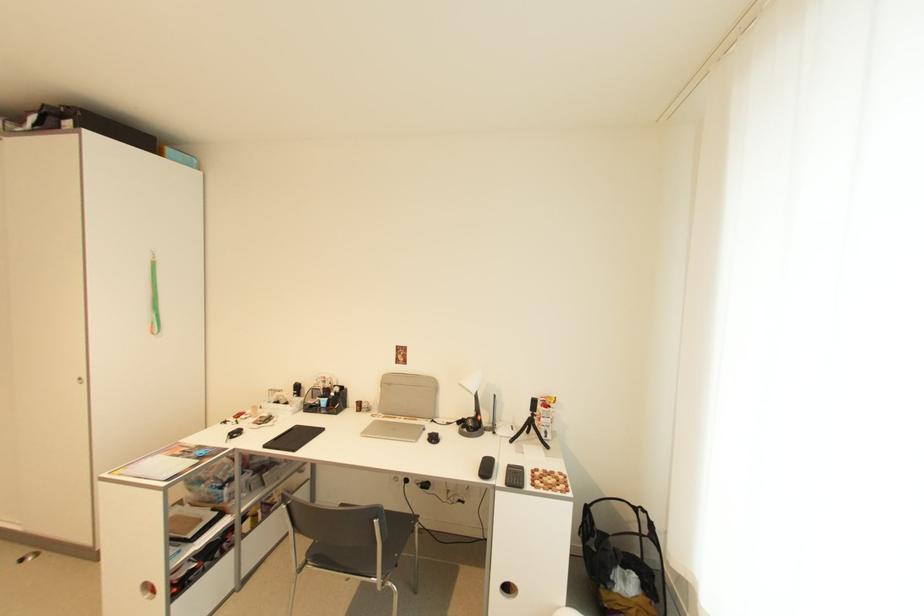
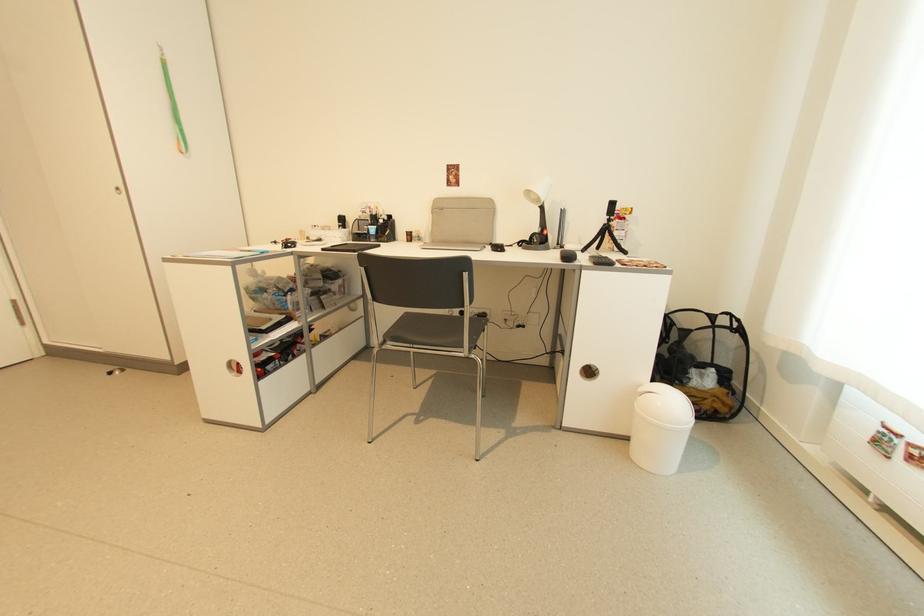
Where in the second image is the point corresponding to the point at 536,411 from the first image?

(612, 217)